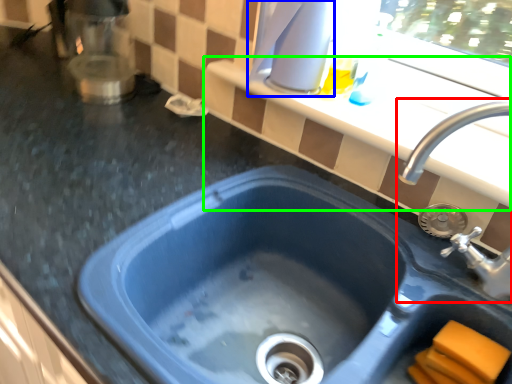
Question: Considering the real-world distances, which object is closest to sink (highlighted by a red box)? appliance (highlighted by a blue box) or window sill (highlighted by a green box).

Choices:
 (A) appliance
 (B) window sill

Answer: (B)